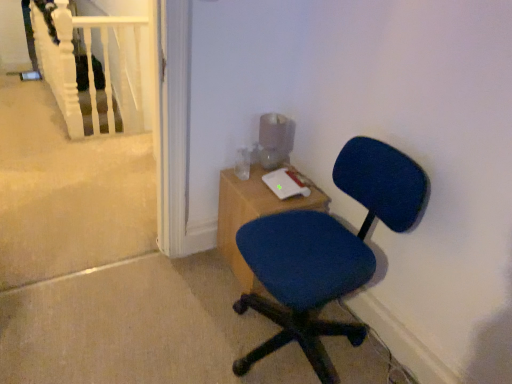
Question: Considering the relative positions of wooden desk at center and blue fabric chair at center in the image provided, is wooden desk at center behind blue fabric chair at center?

Choices:
 (A) yes
 (B) no

Answer: (A)

Question: Is wooden desk at center positioned in front of blue fabric chair at center?

Choices:
 (A) yes
 (B) no

Answer: (B)

Question: Is wooden desk at center outside of blue fabric chair at center?

Choices:
 (A) no
 (B) yes

Answer: (B)

Question: From the image's perspective, is wooden desk at center beneath blue fabric chair at center?

Choices:
 (A) no
 (B) yes

Answer: (A)

Question: From a real-world perspective, does wooden desk at center stand above blue fabric chair at center?

Choices:
 (A) yes
 (B) no

Answer: (B)

Question: Relative to blue fabric chair at center, is wooden desk at center in front or behind?

Choices:
 (A) behind
 (B) front

Answer: (A)

Question: Is wooden desk at center wider or thinner than blue fabric chair at center?

Choices:
 (A) wide
 (B) thin

Answer: (B)

Question: Is wooden desk at center inside or outside of blue fabric chair at center?

Choices:
 (A) outside
 (B) inside

Answer: (A)

Question: From the image's perspective, is wooden desk at center positioned above or below blue fabric chair at center?

Choices:
 (A) below
 (B) above

Answer: (B)

Question: Would you say wooden desk at center is inside or outside white matte rail at upper left?

Choices:
 (A) inside
 (B) outside

Answer: (B)

Question: From a real-world perspective, is wooden desk at center positioned above or below white matte rail at upper left?

Choices:
 (A) below
 (B) above

Answer: (A)

Question: Based on their sizes in the image, would you say wooden desk at center is bigger or smaller than white matte rail at upper left?

Choices:
 (A) small
 (B) big

Answer: (B)

Question: In terms of width, does wooden desk at center look wider or thinner when compared to white matte rail at upper left?

Choices:
 (A) wide
 (B) thin

Answer: (A)

Question: Based on their sizes in the image, would you say white matte rail at upper left is bigger or smaller than wooden desk at center?

Choices:
 (A) big
 (B) small

Answer: (B)

Question: In terms of height, does white matte rail at upper left look taller or shorter compared to wooden desk at center?

Choices:
 (A) tall
 (B) short

Answer: (A)